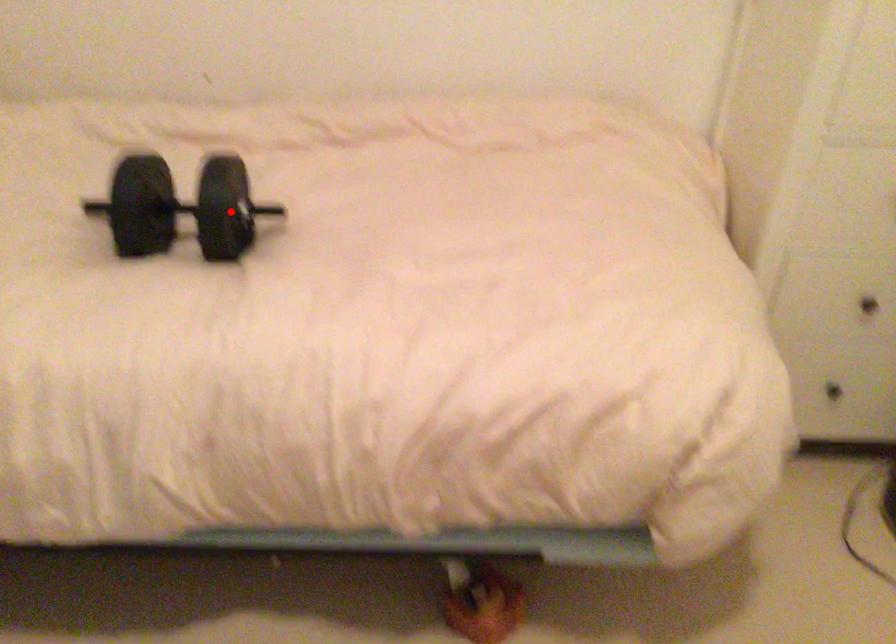
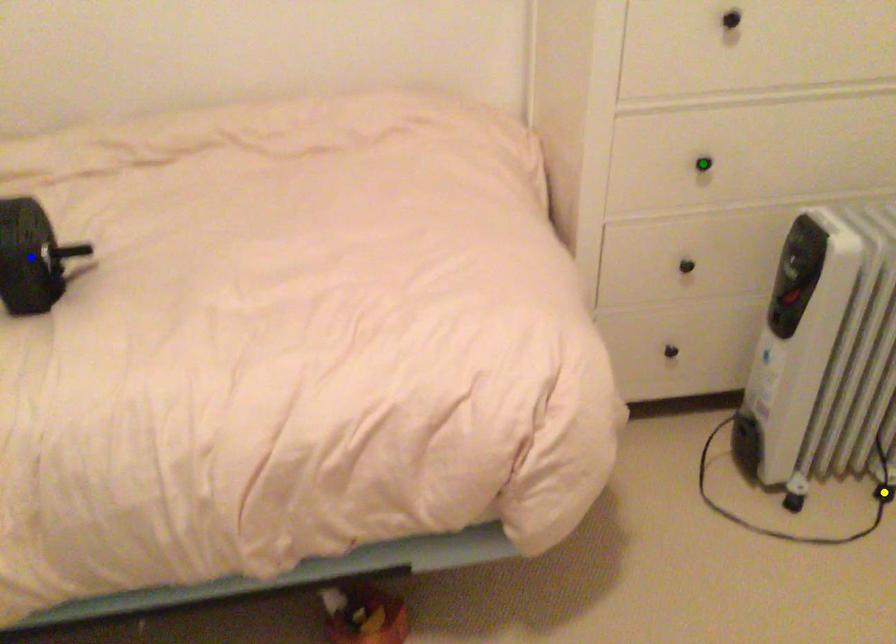
Question: I am providing you with two images of the same scene from different viewpoints. A red point is marked on the first image. You are given multiple points on the second image. In image 2, which mark is for the same physical point as the one in image 1?

Choices:
 (A) green point
 (B) blue point
 (C) yellow point

Answer: (B)